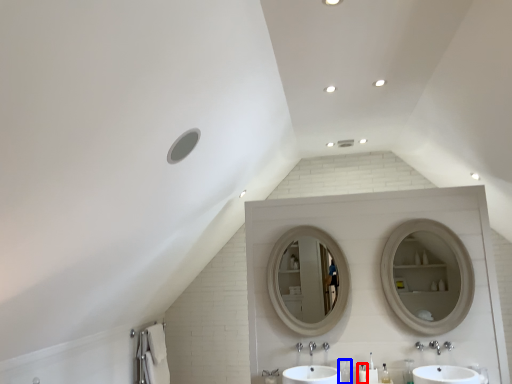
Question: Which object is further to the camera taking this photo, toiletry (highlighted by a red box) or toiletry (highlighted by a blue box)?

Choices:
 (A) toiletry
 (B) toiletry

Answer: (B)